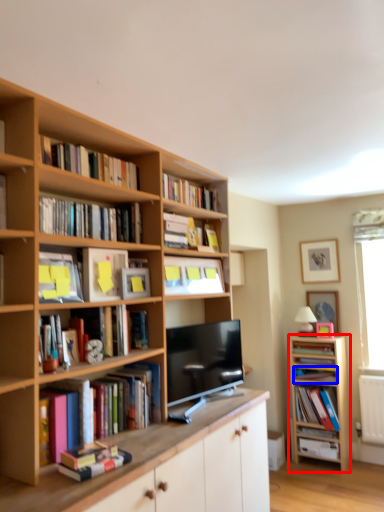
Question: Among these objects, which one is farthest to the camera, cabinetry (highlighted by a red box) or book (highlighted by a blue box)?

Choices:
 (A) cabinetry
 (B) book

Answer: (B)